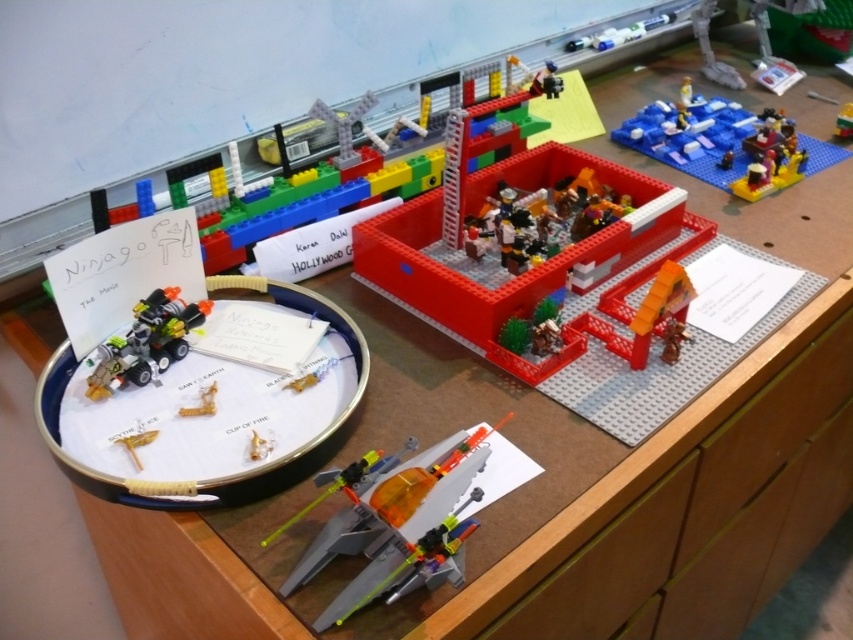
Is point (416, 506) behind point (258, 444)?

No, it is not.

Consider the image. Between translucent orange plastic spaceship at center and metallic gold cup at center, which one has less height?

Standing shorter between the two is metallic gold cup at center.

The width and height of the screenshot is (853, 640). Describe the element at coordinates (399, 524) in the screenshot. I see `translucent orange plastic spaceship at center` at that location.

The height and width of the screenshot is (640, 853). Identify the location of translucent orange plastic spaceship at center. (399, 524).

What do you see at coordinates (524, 269) in the screenshot?
I see `bright red plastic building at center` at bounding box center [524, 269].

Is bright red plastic building at center positioned in front of metallic gold cup at center?

No, bright red plastic building at center is behind metallic gold cup at center.

Identify the location of bright red plastic building at center. The height and width of the screenshot is (640, 853). (524, 269).

The height and width of the screenshot is (640, 853). In order to click on bright red plastic building at center in this screenshot , I will do `click(524, 269)`.

Is brick-like plastic minifigures at upper right taller than translucent orange plastic cup at lower left?

Indeed, brick-like plastic minifigures at upper right has a greater height compared to translucent orange plastic cup at lower left.

Which of these two, brick-like plastic minifigures at upper right or translucent orange plastic cup at lower left, stands taller?

With more height is brick-like plastic minifigures at upper right.

Locate an element on the screen. brick-like plastic minifigures at upper right is located at coordinates (694, 136).